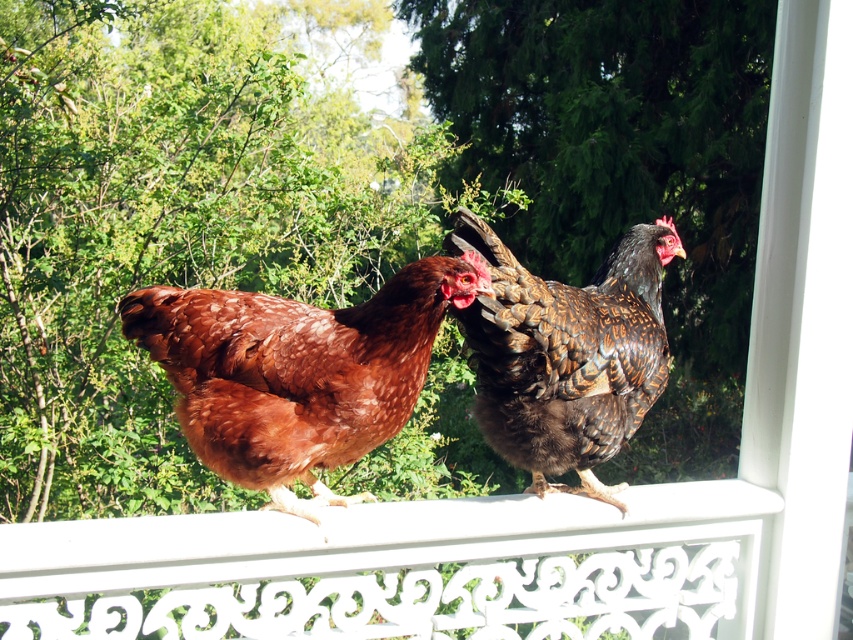
Can you confirm if brown feathered chicken at center is taller than brown speckled chicken at center?

No, brown feathered chicken at center is not taller than brown speckled chicken at center.

Between brown feathered chicken at center and brown speckled chicken at center, which one has less height?

Standing shorter between the two is brown feathered chicken at center.

Between point (303, 324) and point (503, 424), which one is positioned behind?

The point (503, 424) is behind.

The height and width of the screenshot is (640, 853). I want to click on brown feathered chicken at center, so click(297, 371).